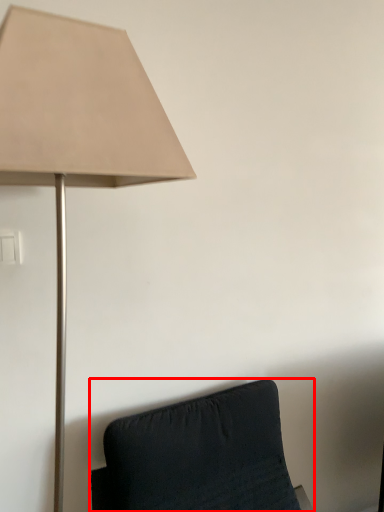
Question: Considering the relative positions of furniture (annotated by the red box) and lamp in the image provided, where is furniture (annotated by the red box) located with respect to the staircase?

Choices:
 (A) left
 (B) right

Answer: (B)